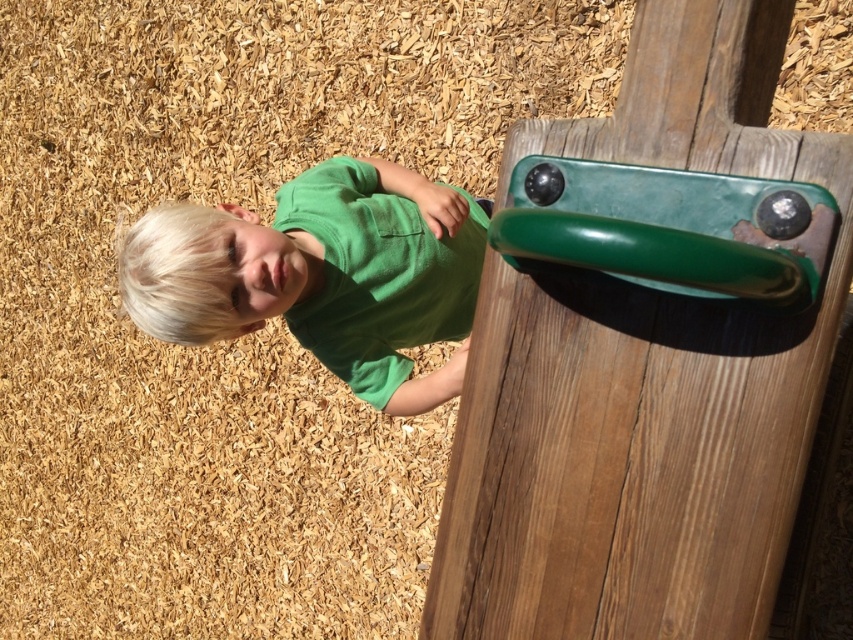
Measure the distance between green glossy handle at upper right and camera.

green glossy handle at upper right is 28.66 inches away from camera.

This screenshot has width=853, height=640. What do you see at coordinates (641, 381) in the screenshot?
I see `green glossy handle at upper right` at bounding box center [641, 381].

Locate an element on the screen. This screenshot has height=640, width=853. green glossy handle at upper right is located at coordinates (641, 381).